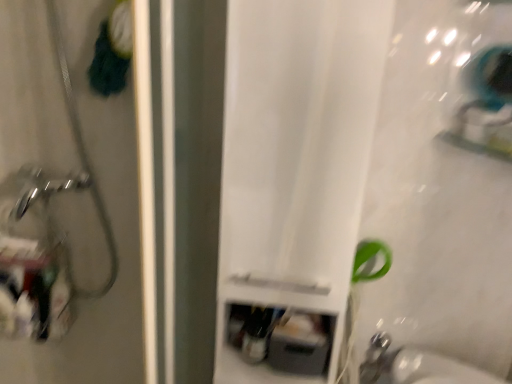
Question: Should I look upward or downward to see brushed metal showerhead at left?

Choices:
 (A) down
 (B) up

Answer: (B)

Question: Are brushed metal showerhead at left and white matte curtain at center far apart?

Choices:
 (A) no
 (B) yes

Answer: (A)

Question: Does brushed metal showerhead at left have a greater width compared to white matte curtain at center?

Choices:
 (A) yes
 (B) no

Answer: (B)

Question: Does brushed metal showerhead at left have a larger size compared to white matte curtain at center?

Choices:
 (A) no
 (B) yes

Answer: (A)

Question: Is brushed metal showerhead at left taller than white matte curtain at center?

Choices:
 (A) no
 (B) yes

Answer: (A)

Question: From the image's perspective, is brushed metal showerhead at left on white matte curtain at center?

Choices:
 (A) no
 (B) yes

Answer: (B)

Question: Is the position of brushed metal showerhead at left less distant than that of white matte curtain at center?

Choices:
 (A) no
 (B) yes

Answer: (A)

Question: Is the position of white matte curtain at center less distant than that of satin nickel faucet at lower right?

Choices:
 (A) yes
 (B) no

Answer: (A)

Question: From a real-world perspective, is white matte curtain at center located higher than satin nickel faucet at lower right?

Choices:
 (A) yes
 (B) no

Answer: (A)

Question: Can you confirm if white matte curtain at center is thinner than satin nickel faucet at lower right?

Choices:
 (A) yes
 (B) no

Answer: (B)

Question: Considering the relative sizes of white matte curtain at center and satin nickel faucet at lower right in the image provided, is white matte curtain at center wider than satin nickel faucet at lower right?

Choices:
 (A) no
 (B) yes

Answer: (B)

Question: Is white matte curtain at center oriented towards satin nickel faucet at lower right?

Choices:
 (A) yes
 (B) no

Answer: (B)

Question: Is white matte curtain at center positioned far away from satin nickel faucet at lower right?

Choices:
 (A) yes
 (B) no

Answer: (B)

Question: Does brushed metal showerhead at left appear on the left side of satin nickel faucet at lower right?

Choices:
 (A) yes
 (B) no

Answer: (A)